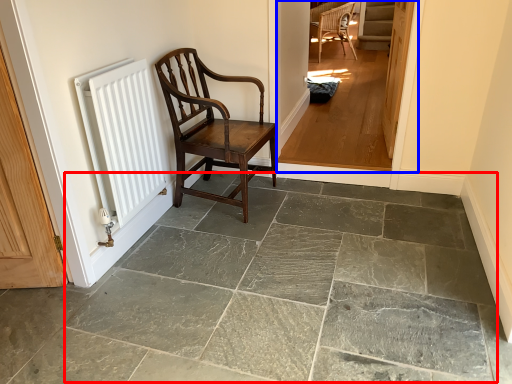
Question: Which object appears farthest to the camera in this image, limestone (highlighted by a red box) or corridor (highlighted by a blue box)?

Choices:
 (A) limestone
 (B) corridor

Answer: (B)